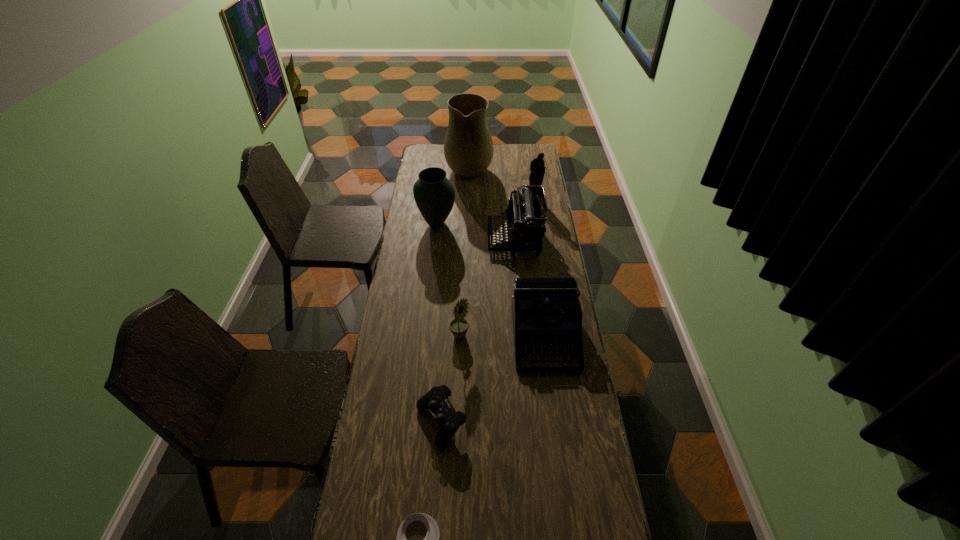
This screenshot has height=540, width=960. Find the location of `vase that is at the left edge`. vase that is at the left edge is located at coordinates coord(434,194).

Find the location of `control that is at the left edge`. control that is at the left edge is located at coordinates (436, 400).

The height and width of the screenshot is (540, 960). In order to click on figurine that is positioned at the right edge in this screenshot , I will do `click(537, 168)`.

The height and width of the screenshot is (540, 960). I want to click on vacant region at the left edge, so click(x=400, y=268).

This screenshot has width=960, height=540. In the image, there is a desktop. In order to click on free space at the right edge in this screenshot , I will do `click(588, 501)`.

I want to click on free space at the far left corner, so click(421, 160).

What are the coordinates of `vacant space in between the sixth tallest object and the seventh farthest object` in the screenshot? It's located at (492, 380).

Identify the location of free space between the sunflower and the tallest object. (465, 251).

The width and height of the screenshot is (960, 540). What are the coordinates of `free area in between the vase and the seventh tallest object` in the screenshot? It's located at (439, 323).

Find the location of a particular element. free area in between the tallest object and the sunflower is located at coordinates (465, 251).